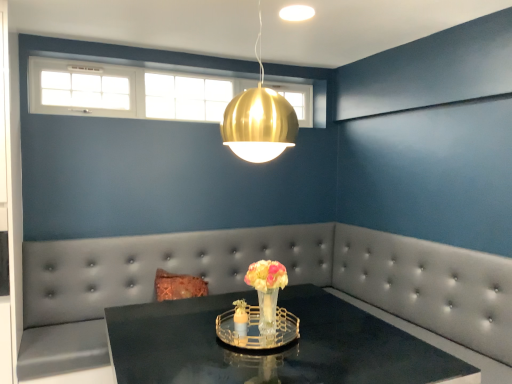
Question: Could white glass window at upper center be considered to be inside tufted leather couch at center?

Choices:
 (A) yes
 (B) no

Answer: (B)

Question: From a real-world perspective, is tufted leather couch at center physically above white glass window at upper center?

Choices:
 (A) yes
 (B) no

Answer: (B)

Question: From the image's perspective, is tufted leather couch at center on top of white glass window at upper center?

Choices:
 (A) no
 (B) yes

Answer: (A)

Question: Does tufted leather couch at center turn towards white glass window at upper center?

Choices:
 (A) no
 (B) yes

Answer: (A)

Question: Can you confirm if tufted leather couch at center is thinner than white glass window at upper center?

Choices:
 (A) yes
 (B) no

Answer: (B)

Question: From a real-world perspective, is tufted leather couch at center physically below white glass window at upper center?

Choices:
 (A) no
 (B) yes

Answer: (B)

Question: From a real-world perspective, is shiny black table at center beneath tufted leather couch at center?

Choices:
 (A) no
 (B) yes

Answer: (B)

Question: Can you confirm if shiny black table at center is thinner than tufted leather couch at center?

Choices:
 (A) no
 (B) yes

Answer: (A)

Question: Would you say tufted leather couch at center is part of shiny black table at center's contents?

Choices:
 (A) yes
 (B) no

Answer: (B)

Question: From a real-world perspective, is shiny black table at center on tufted leather couch at center?

Choices:
 (A) yes
 (B) no

Answer: (B)

Question: Is shiny black table at center wider than tufted leather couch at center?

Choices:
 (A) yes
 (B) no

Answer: (A)

Question: Are shiny black table at center and tufted leather couch at center making contact?

Choices:
 (A) no
 (B) yes

Answer: (A)

Question: Is translucent glass vase at center positioned beyond the bounds of tufted leather couch at center?

Choices:
 (A) no
 (B) yes

Answer: (B)